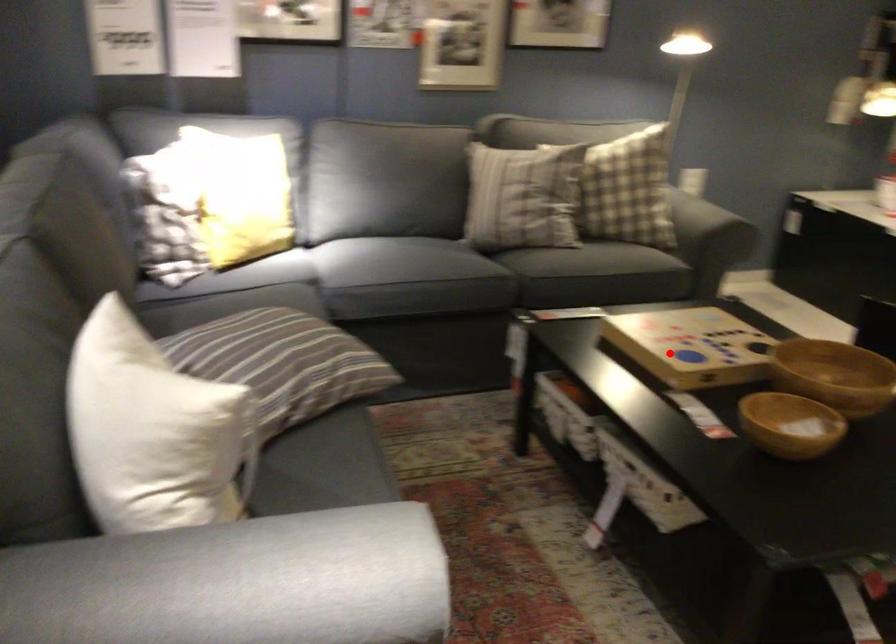
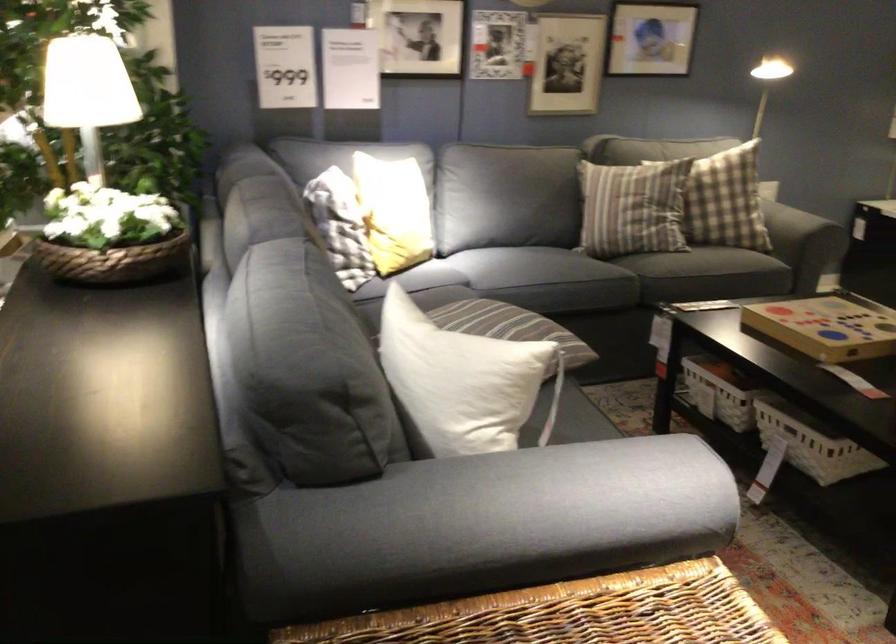
In the second image, find the point that corresponds to the highlighted location in the first image.

(828, 326)